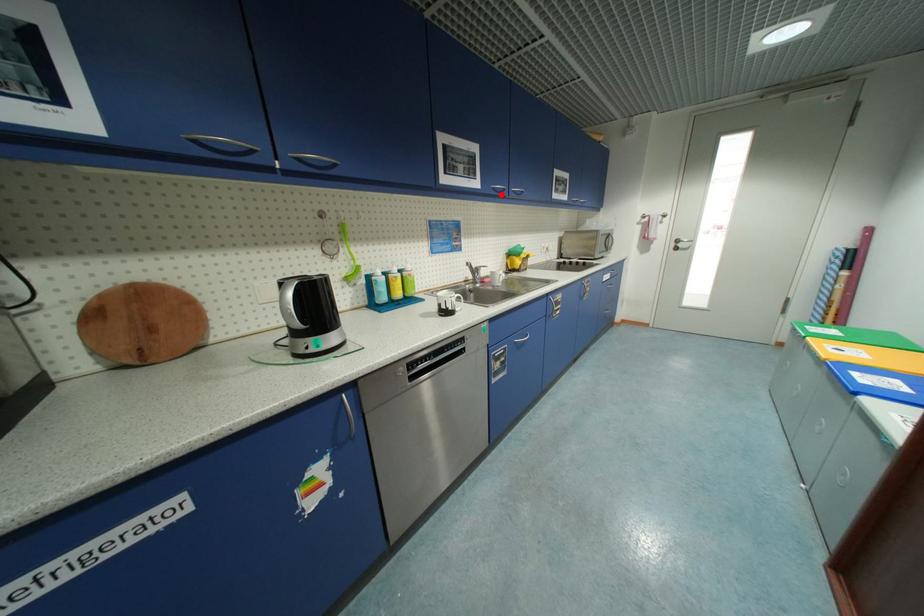
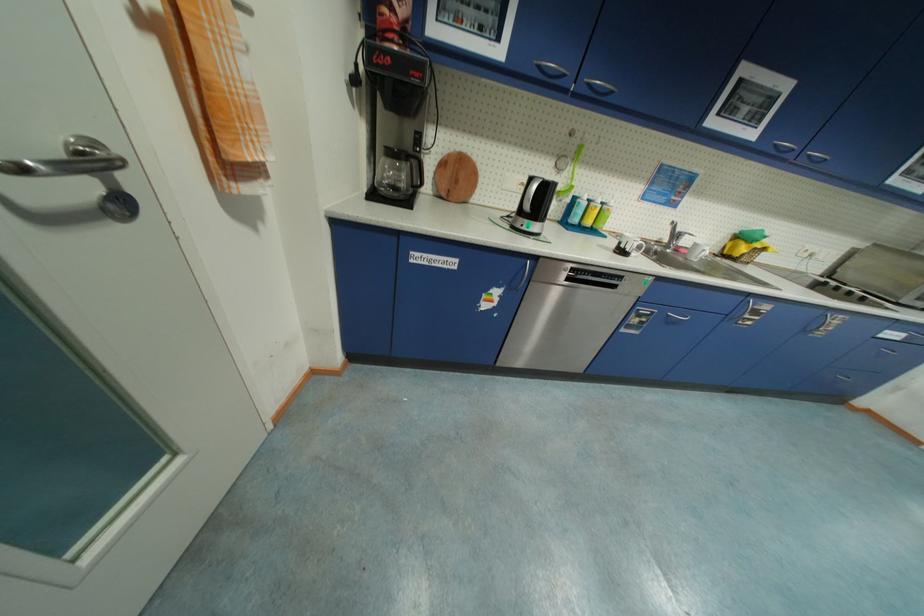
The point at the highlighted location is marked in the first image. Where is the corresponding point in the second image?

(780, 154)